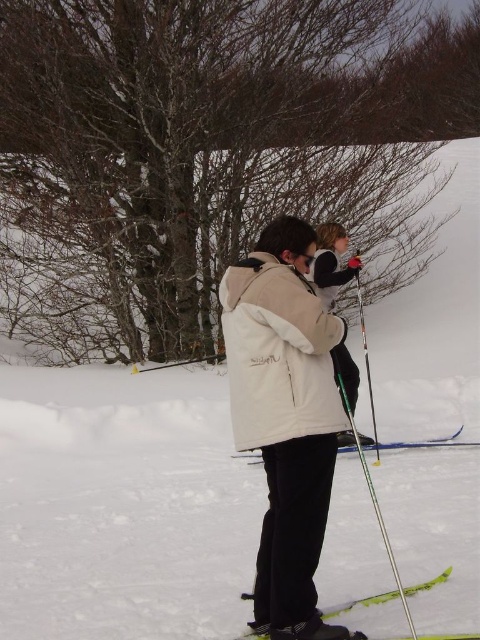
You are a photographer trying to capture a clear photo of both the green plastic ski pole at center and the blue plastic ski at center. Which object should you focus on first to ensure it appears sharp in the photo?

The green plastic ski pole at center is above the blue plastic ski at center, so you should focus on the green plastic ski pole at center first to ensure it appears sharp in the photo.

You are a photographer trying to capture the green glossy ski at lower center. Based on its coordinates, where should you position your camera to ensure it is centered in your shot?

The green glossy ski at lower center is located at point coordinates, so positioning the camera directly facing that coordinate will center it in the shot.

In the scene shown: You are a ski equipment inspector and need to determine if the green plastic ski pole at center can be used with the blue plastic ski at center. Based on their thickness, will the pole fit into the binding of the ski?

The green plastic ski pole at center is thinner than the blue plastic ski at center, so the pole can fit into the binding of the ski since it is thinner than the ski itself.